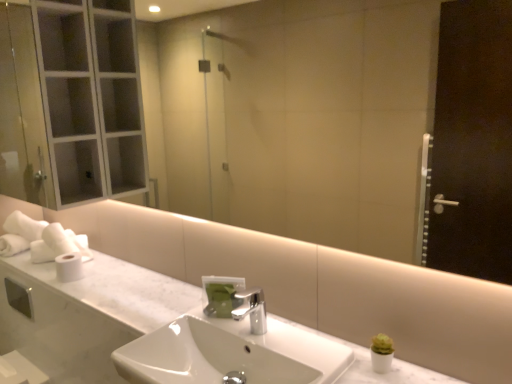
Locate an element on the screen. This screenshot has height=384, width=512. blank space to the left of polished metallic faucet at center is located at coordinates (214, 321).